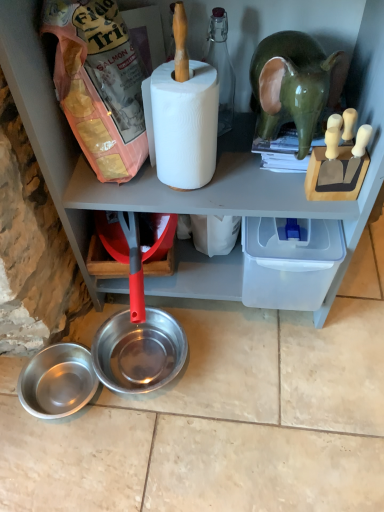
This screenshot has width=384, height=512. What do you see at coordinates (139, 351) in the screenshot?
I see `shiny metallic bowl at lower center, which is counted as the 2th bowl, starting from the left` at bounding box center [139, 351].

In order to click on brushed metal bowl at lower left, the 1th bowl positioned from the left in this screenshot , I will do `click(57, 381)`.

Considering their positions, is brushed metal bowl at lower left, the 1th bowl positioned from the left, located in front of or behind green glossy elephant at upper right?

brushed metal bowl at lower left, the 1th bowl positioned from the left, is behind green glossy elephant at upper right.

Between brushed metal bowl at lower left, the 1th bowl positioned from the left, and green glossy elephant at upper right, which one has larger size?

Bigger between the two is green glossy elephant at upper right.

Is brushed metal bowl at lower left, the 1th bowl positioned from the left, completely or partially outside of green glossy elephant at upper right?

Absolutely, brushed metal bowl at lower left, the 1th bowl positioned from the left, is external to green glossy elephant at upper right.

From a real-world perspective, which object rests below the other?

In real-world perspective, shiny metallic bowl at lower center, the 1th bowl when ordered from right to left, is lower.

Image resolution: width=384 pixels, height=512 pixels. What are the coordinates of `bowl that is the 2nd object located behind the white matte paper towel at center` in the screenshot? It's located at (139, 351).

Is white matte paper towel at center positioned behind shiny metallic bowl at lower center, which is counted as the 2th bowl, starting from the left?

No, white matte paper towel at center is in front of shiny metallic bowl at lower center, which is counted as the 2th bowl, starting from the left.

Is point (195, 76) farther from viewer compared to point (154, 329)?

That is False.

Is brushed metal bowl at lower left, the 1th bowl positioned from the left, facing towards matte pink plastic bag of dog food at upper left?

No, brushed metal bowl at lower left, the 1th bowl positioned from the left, is not oriented towards matte pink plastic bag of dog food at upper left.

Which of these two, brushed metal bowl at lower left, the 1th bowl positioned from the left, or matte pink plastic bag of dog food at upper left, stands shorter?

With less height is brushed metal bowl at lower left, the 1th bowl positioned from the left.

What's the angular difference between brushed metal bowl at lower left, the 1th bowl positioned from the left, and matte pink plastic bag of dog food at upper left's facing directions?

93.1 degrees.

Are brushed metal bowl at lower left, the 1th bowl positioned from the left, and matte pink plastic bag of dog food at upper left making contact?

No, brushed metal bowl at lower left, the 1th bowl positioned from the left, is not with matte pink plastic bag of dog food at upper left.

Is white matte paper towel at center positioned with its back to green glossy elephant at upper right?

Answer: No, white matte paper towel at center is not facing away from green glossy elephant at upper right.

Is point (167, 153) positioned before point (304, 90)?

That is False.

Is white matte paper towel at center not inside green glossy elephant at upper right?

Yes, white matte paper towel at center is outside of green glossy elephant at upper right.

From a real-world perspective, is matte pink plastic bag of dog food at upper left physically below green glossy elephant at upper right?

Actually, matte pink plastic bag of dog food at upper left is physically above green glossy elephant at upper right in the real world.

How distant is matte pink plastic bag of dog food at upper left from green glossy elephant at upper right?

matte pink plastic bag of dog food at upper left and green glossy elephant at upper right are 31.23 centimeters apart.

Which object is positioned more to the right, matte pink plastic bag of dog food at upper left or green glossy elephant at upper right?

Positioned to the right is green glossy elephant at upper right.

From the picture: Does matte pink plastic bag of dog food at upper left have a greater height compared to green glossy elephant at upper right?

Yes.

Looking at this image, is green glossy elephant at upper right further to the viewer compared to matte pink plastic bag of dog food at upper left?

That is True.

Is green glossy elephant at upper right spatially inside matte pink plastic bag of dog food at upper left, or outside of it?

green glossy elephant at upper right cannot be found inside matte pink plastic bag of dog food at upper left.

Looking at this image, could you tell me if green glossy elephant at upper right is turned towards matte pink plastic bag of dog food at upper left?

No.

Does green glossy elephant at upper right have a larger size compared to matte pink plastic bag of dog food at upper left?

No.

In the image, is shiny metallic bowl at lower center, which is counted as the 2th bowl, starting from the left, positioned in front of or behind brushed metal bowl at lower left, the 1th bowl positioned from the left?

Visually, shiny metallic bowl at lower center, which is counted as the 2th bowl, starting from the left, is located behind brushed metal bowl at lower left, the 1th bowl positioned from the left.

Is shiny metallic bowl at lower center, the 1th bowl when ordered from right to left, positioned far away from brushed metal bowl at lower left, which appears as the 2th bowl when viewed from the right?

They are positioned close to each other.

Who is shorter, shiny metallic bowl at lower center, which is counted as the 2th bowl, starting from the left, or brushed metal bowl at lower left, the 1th bowl positioned from the left?

Standing shorter between the two is brushed metal bowl at lower left, the 1th bowl positioned from the left.

You are a GUI agent. You are given a task and a screenshot of the screen. Output one action in this format:
    pyautogui.click(x=<x>, y=<y>)
    Task: Click on the animal to the right of brushed metal bowl at lower left, which appears as the 2th bowl when viewed from the right
    The width and height of the screenshot is (384, 512).
    Given the screenshot: What is the action you would take?
    pyautogui.click(x=290, y=85)

Where is `paper towel above the shiny metallic bowl at lower center, which is counted as the 2th bowl, starting from the left (from a real-world perspective)`? Image resolution: width=384 pixels, height=512 pixels. paper towel above the shiny metallic bowl at lower center, which is counted as the 2th bowl, starting from the left (from a real-world perspective) is located at coordinates (182, 124).

Based on their spatial positions, is matte pink plastic bag of dog food at upper left or shiny metallic bowl at lower center, which is counted as the 2th bowl, starting from the left, further from brushed metal bowl at lower left, the 1th bowl positioned from the left?

matte pink plastic bag of dog food at upper left is further to brushed metal bowl at lower left, the 1th bowl positioned from the left.

From the image, which object appears to be farther from white matte paper towel at center, green glossy elephant at upper right or shiny metallic bowl at lower center, which is counted as the 2th bowl, starting from the left?

Based on the image, shiny metallic bowl at lower center, which is counted as the 2th bowl, starting from the left, appears to be further to white matte paper towel at center.

Estimate the real-world distances between objects in this image. Which object is further from green glossy elephant at upper right, brushed metal bowl at lower left, which appears as the 2th bowl when viewed from the right, or matte pink plastic bag of dog food at upper left?

brushed metal bowl at lower left, which appears as the 2th bowl when viewed from the right, is positioned further to the anchor green glossy elephant at upper right.

Based on their spatial positions, is white matte paper towel at center or brushed metal bowl at lower left, which appears as the 2th bowl when viewed from the right, closer to matte pink plastic bag of dog food at upper left?

Based on the image, white matte paper towel at center appears to be nearer to matte pink plastic bag of dog food at upper left.

Estimate the real-world distances between objects in this image. Which object is further from brushed metal bowl at lower left, which appears as the 2th bowl when viewed from the right, white matte paper towel at center or green glossy elephant at upper right?

green glossy elephant at upper right is positioned further to the anchor brushed metal bowl at lower left, which appears as the 2th bowl when viewed from the right.

Based on the photo, considering their positions, is brushed metal bowl at lower left, which appears as the 2th bowl when viewed from the right, positioned further to white matte paper towel at center than shiny metallic bowl at lower center, which is counted as the 2th bowl, starting from the left?

brushed metal bowl at lower left, which appears as the 2th bowl when viewed from the right.

When comparing their distances from white matte paper towel at center, does shiny metallic bowl at lower center, which is counted as the 2th bowl, starting from the left, or brushed metal bowl at lower left, the 1th bowl positioned from the left, seem further?

brushed metal bowl at lower left, the 1th bowl positioned from the left, is positioned further to the anchor white matte paper towel at center.

Considering their positions, is green glossy elephant at upper right positioned closer to brushed metal bowl at lower left, the 1th bowl positioned from the left, than white matte paper towel at center?

Among the two, white matte paper towel at center is located nearer to brushed metal bowl at lower left, the 1th bowl positioned from the left.

Image resolution: width=384 pixels, height=512 pixels. Identify the location of bowl between matte pink plastic bag of dog food at upper left and brushed metal bowl at lower left, which appears as the 2th bowl when viewed from the right, in the vertical direction. (139, 351).

This screenshot has height=512, width=384. I want to click on paper towel between green glossy elephant at upper right and brushed metal bowl at lower left, the 1th bowl positioned from the left, from top to bottom, so click(x=182, y=124).

Locate an element on the screen. Image resolution: width=384 pixels, height=512 pixels. paper towel between matte pink plastic bag of dog food at upper left and brushed metal bowl at lower left, the 1th bowl positioned from the left, in the up-down direction is located at coordinates (182, 124).

What are the coordinates of `bowl that lies between green glossy elephant at upper right and brushed metal bowl at lower left, the 1th bowl positioned from the left, from top to bottom` in the screenshot? It's located at (139, 351).